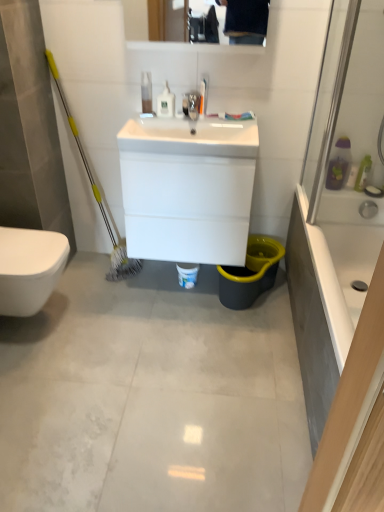
Question: In terms of height, does translucent plastic toothbrush at upper right, positioned as the third toiletry in left-to-right order, look taller or shorter compared to white glossy bidet at lower left?

Choices:
 (A) tall
 (B) short

Answer: (B)

Question: Is translucent plastic toothbrush at upper right, positioned as the third toiletry in left-to-right order, to the left or to the right of white glossy bidet at lower left in the image?

Choices:
 (A) left
 (B) right

Answer: (B)

Question: Which object is positioned closest to the white glossy sink at center, which is the first sink in bottom-to-top order?

Choices:
 (A) gray tile floor at center
 (B) white glossy bidet at lower left
 (C) white glossy bottle at upper center, which is the 2th toiletry from top to bottom
 (D) translucent plastic toothbrush at upper right, which is the 3th toiletry in top-to-bottom order
 (E) white glossy bathtub at right

Answer: (C)

Question: Which object is the farthest from the white glossy bathtub at right?

Choices:
 (A) gray tile floor at center
 (B) translucent plastic bottle at upper center, the 3th toiletry positioned from the right
 (C) white glossy sink at center, which is the first sink from top to bottom
 (D) white glossy bidet at lower left
 (E) translucent plastic toothbrush at upper right, which is the 3th toiletry in top-to-bottom order

Answer: (B)